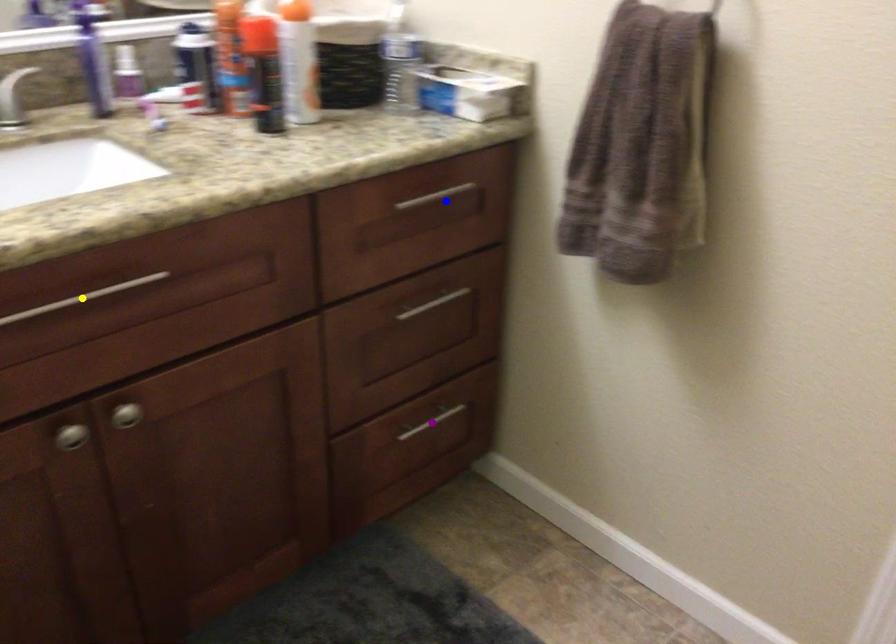
From the picture: Order these from nearest to farthest:
yellow point, blue point, purple point

yellow point
blue point
purple point